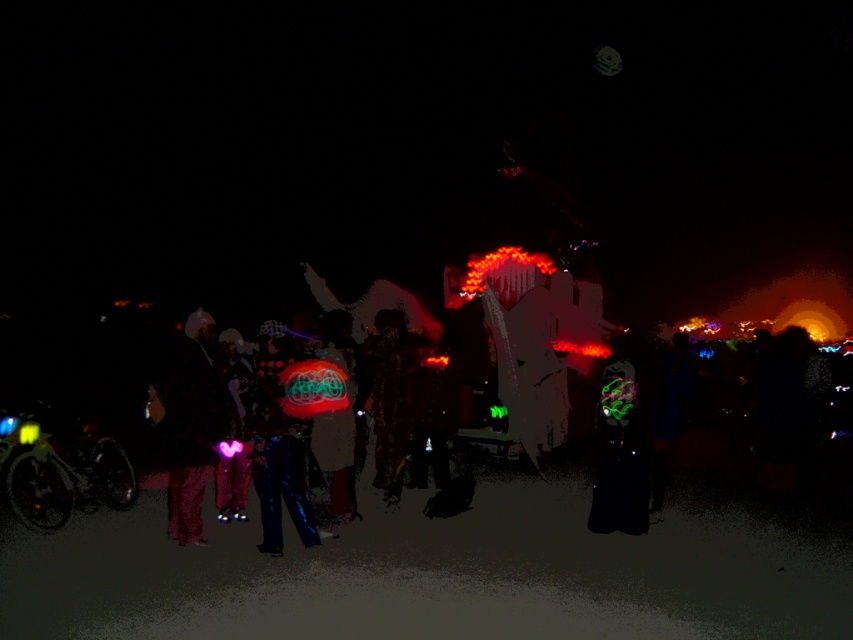
You are standing at the center of the scene and want to locate the pink fabric at center. Which direction should you look to find it?

The pink fabric at center is located at coordinates 0.664 on the x axis and 0.225 on the y axis. Since you are at the center, you should look towards the right and slightly downward to find it.

You are at a nighttime festival where the pink fabric at center and shiny blue pants at center are part of a costume. From the perspective of someone facing the costume, which object is on the left side?

The pink fabric at center is on the left side of the shiny blue pants at center.

You are a photographer at the event and want to capture both the pink fabric at center and the shiny blue pants at center in a single frame. What is the minimum distance you need to maintain between the camera and the subjects to ensure both are in focus?

The pink fabric at center and the shiny blue pants at center are 21.97 inches apart. To ensure both are in focus, the photographer should maintain a distance where the depth of field can cover this distance. A general rule is to be at least twice the distance of the subject separation, so approximately 43.94 inches away.